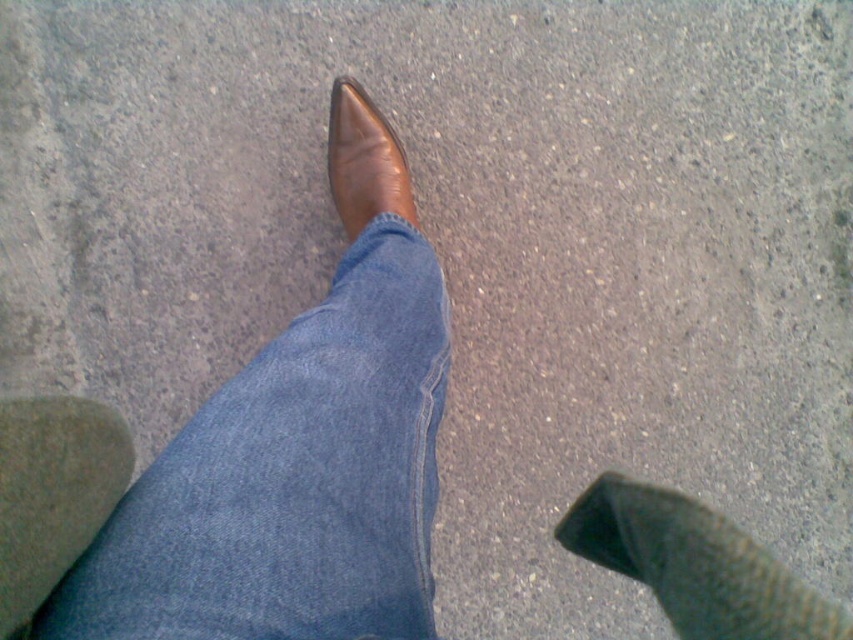
You are a fashion stylist helping a client who wants to ensure their green suede sock at lower left and brown leather shoe at center are positioned correctly. Based on the scene, which object is located to the left of the other?

The green suede sock at lower left is to the left of the brown leather shoe at center.